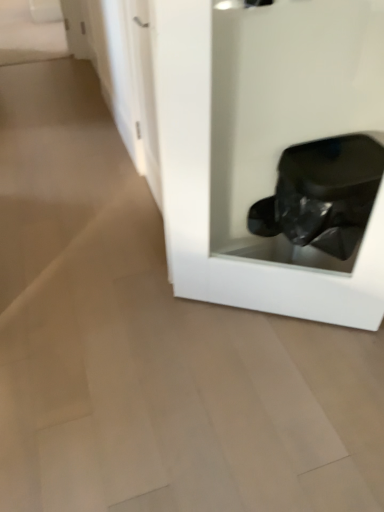
Locate an element on the screen. vacant space in transparent glossy trash can at lower right (from a real-world perspective) is located at coordinates (253, 312).